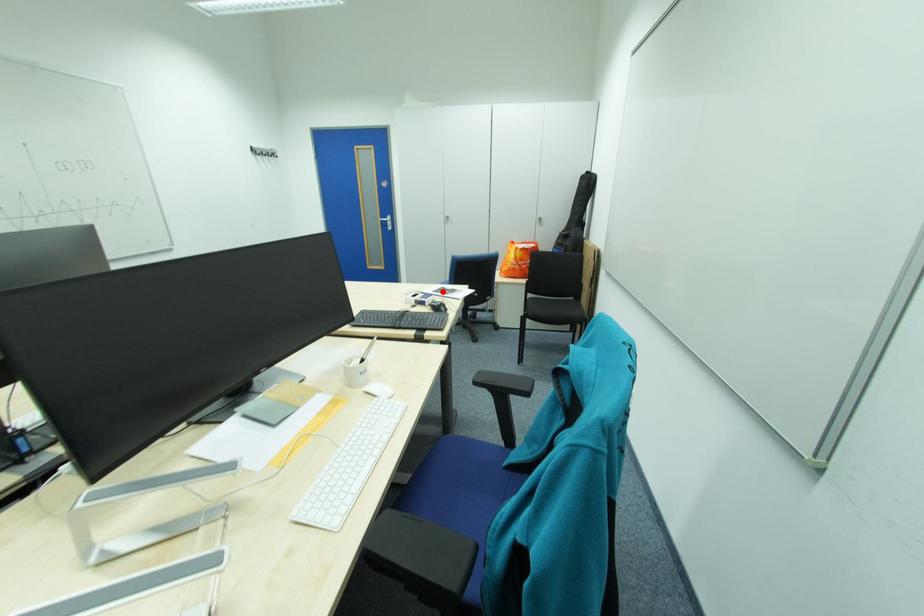
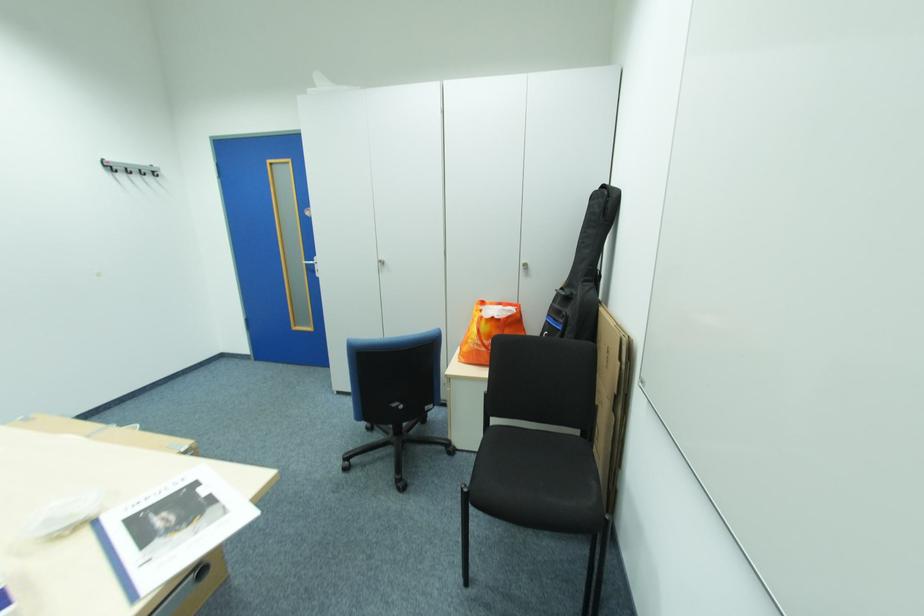
Where in the second image is the point corresponding to the highlighted location from the first image?

(140, 521)